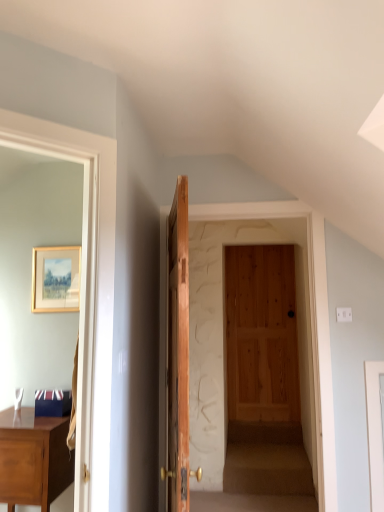
Question: From a real-world perspective, is matte brown desk at left positioned above or below wooden picture frame at upper left?

Choices:
 (A) above
 (B) below

Answer: (B)

Question: From the image's perspective, is matte brown desk at left located above or below wooden picture frame at upper left?

Choices:
 (A) below
 (B) above

Answer: (A)

Question: Estimate the real-world distances between objects in this image. Which object is closer to the wooden picture frame at upper left?

Choices:
 (A) wooden door at center
 (B) matte brown desk at left

Answer: (A)

Question: Which is nearer to the matte brown desk at left?

Choices:
 (A) wooden door at center
 (B) wooden picture frame at upper left

Answer: (A)